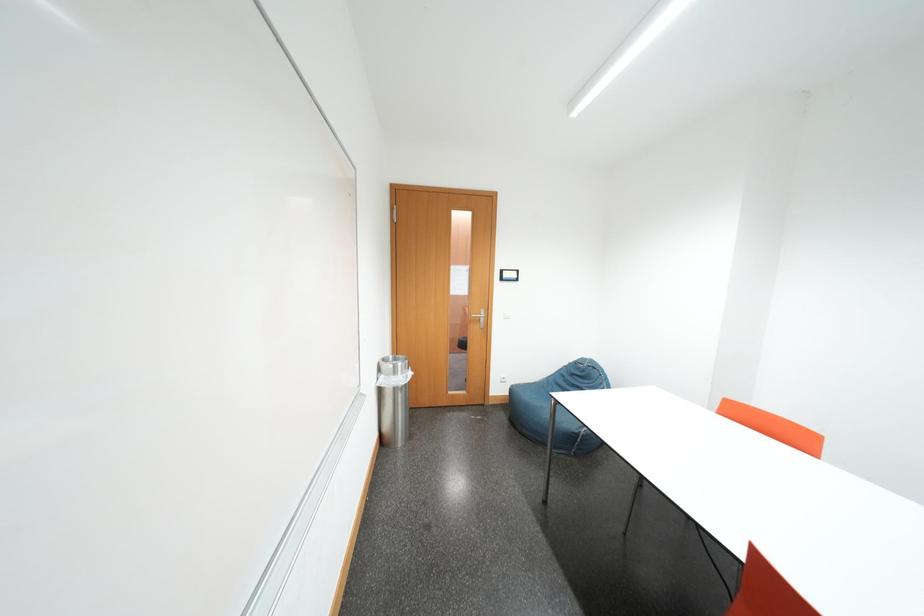
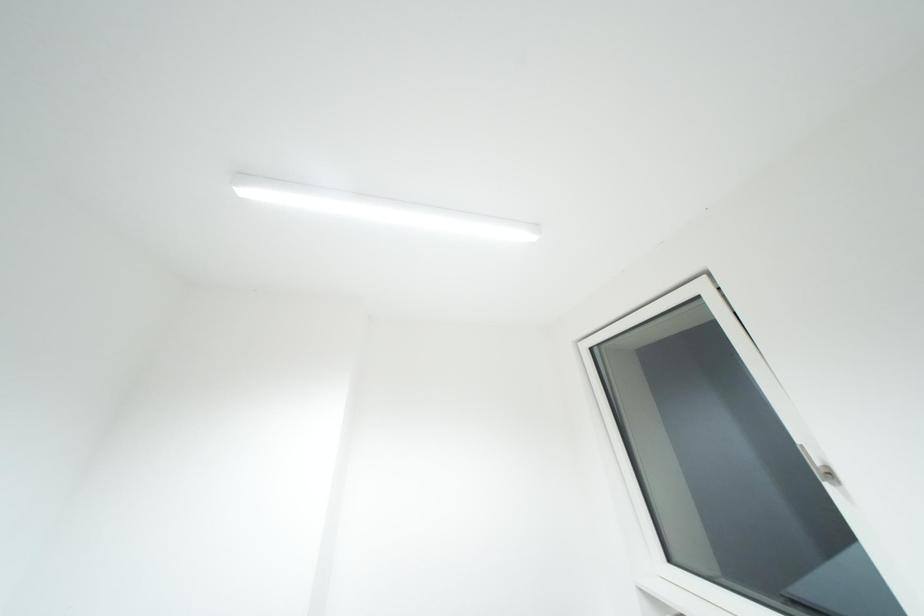
How did the camera likely rotate?

The camera's rotation is toward right-up.